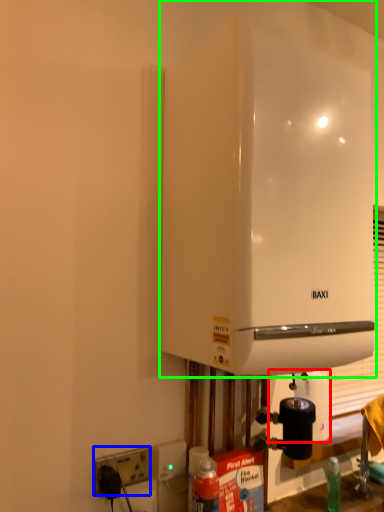
Question: Which object is the farthest from paper towel (highlighted by a red box)? Choose among these: electric outlet (highlighted by a blue box) or home appliance (highlighted by a green box).

Choices:
 (A) electric outlet
 (B) home appliance

Answer: (B)